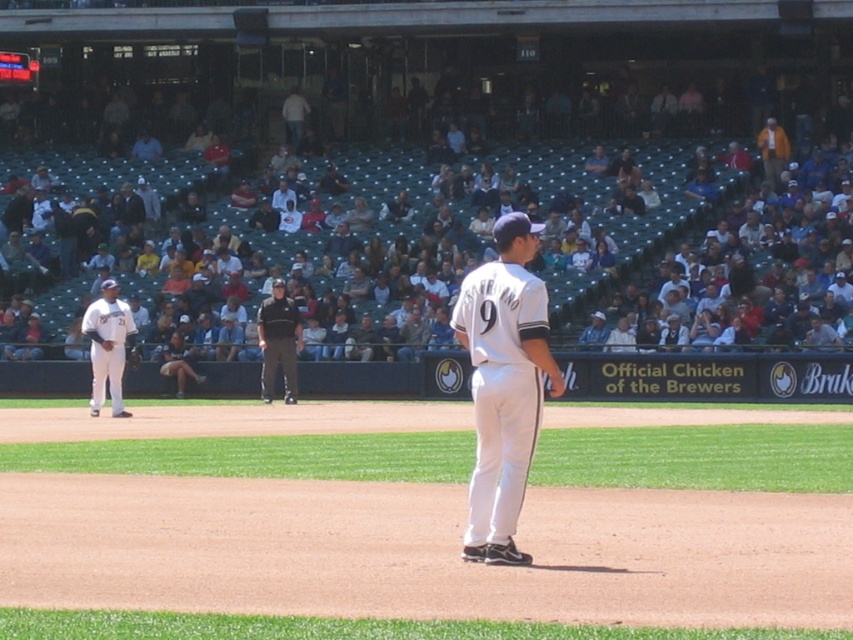
Who is taller, white matte baseball uniform at left or orange cotton shirt at upper right?

Standing taller between the two is orange cotton shirt at upper right.

Is white matte baseball uniform at left thinner than orange cotton shirt at upper right?

Yes.

Is point (115, 365) closer to camera compared to point (775, 145)?

That is True.

Where is `white matte baseball uniform at left`? The image size is (853, 640). white matte baseball uniform at left is located at coordinates pyautogui.click(x=108, y=346).

Which is above, white uniform pants at center or white matte baseball uniform at left?

white matte baseball uniform at left is higher up.

Who is shorter, white uniform pants at center or white matte baseball uniform at left?

white uniform pants at center is shorter.

You are a GUI agent. You are given a task and a screenshot of the screen. Output one action in this format:
    pyautogui.click(x=<x>, y=<y>)
    Task: Click on the white uniform pants at center
    This screenshot has width=853, height=640.
    Given the screenshot: What is the action you would take?
    pyautogui.click(x=421, y=518)

Is point (39, 355) positioned behind point (766, 125)?

No.

Is white plastic seats at upper center thinner than orange cotton shirt at upper right?

In fact, white plastic seats at upper center might be wider than orange cotton shirt at upper right.

Does point (648, 221) come closer to viewer compared to point (780, 131)?

That is True.

Where is `white plastic seats at upper center`? The image size is (853, 640). white plastic seats at upper center is located at coordinates (599, 205).